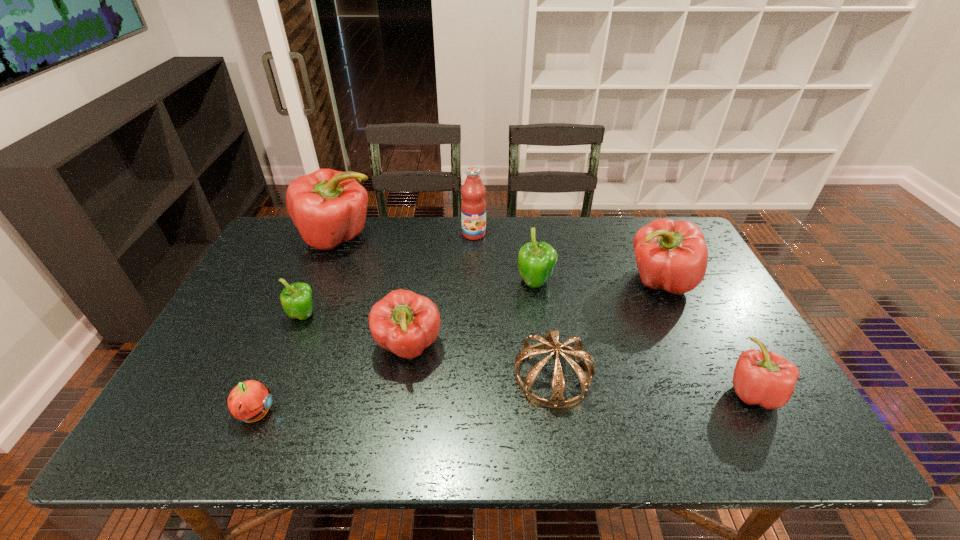
The image size is (960, 540). In order to click on empty space that is in between the smallest pink bell pepper and the tiara in this screenshot , I will do `click(653, 384)`.

The image size is (960, 540). What are the coordinates of `free space that is in between the second biggest pink bell pepper and the fifth object from right to left` in the screenshot? It's located at (566, 258).

Where is `empty space between the leftmost pink bell pepper and the third biggest pink bell pepper`? empty space between the leftmost pink bell pepper and the third biggest pink bell pepper is located at coordinates (373, 293).

Where is `vacant area between the fruit juice and the brown tiara`? The height and width of the screenshot is (540, 960). vacant area between the fruit juice and the brown tiara is located at coordinates (514, 305).

Find the location of `free space between the fifth object from left to right and the third bell pepper from left to right`. free space between the fifth object from left to right and the third bell pepper from left to right is located at coordinates (442, 291).

Identify the location of object that is the second closest to the brown tiara. Image resolution: width=960 pixels, height=540 pixels. (536, 260).

Identify which object is the fourth closest to the smallest pink bell pepper. Please provide its 2D coordinates. Your answer should be formatted as a tuple, i.e. [(x, y)], where the tuple contains the x and y coordinates of a point satisfying the conditions above.

[(405, 323)]

Locate which bell pepper ranks second in proximity to the smaller green bell pepper. Please provide its 2D coordinates. Your answer should be formatted as a tuple, i.e. [(x, y)], where the tuple contains the x and y coordinates of a point satisfying the conditions above.

[(329, 207)]

Identify which bell pepper is the fifth closest to the shortest object. Please provide its 2D coordinates. Your answer should be formatted as a tuple, i.e. [(x, y)], where the tuple contains the x and y coordinates of a point satisfying the conditions above.

[(671, 255)]

Locate which pink bell pepper ranks fourth in proximity to the fruit juice. Please provide its 2D coordinates. Your answer should be formatted as a tuple, i.e. [(x, y)], where the tuple contains the x and y coordinates of a point satisfying the conditions above.

[(764, 378)]